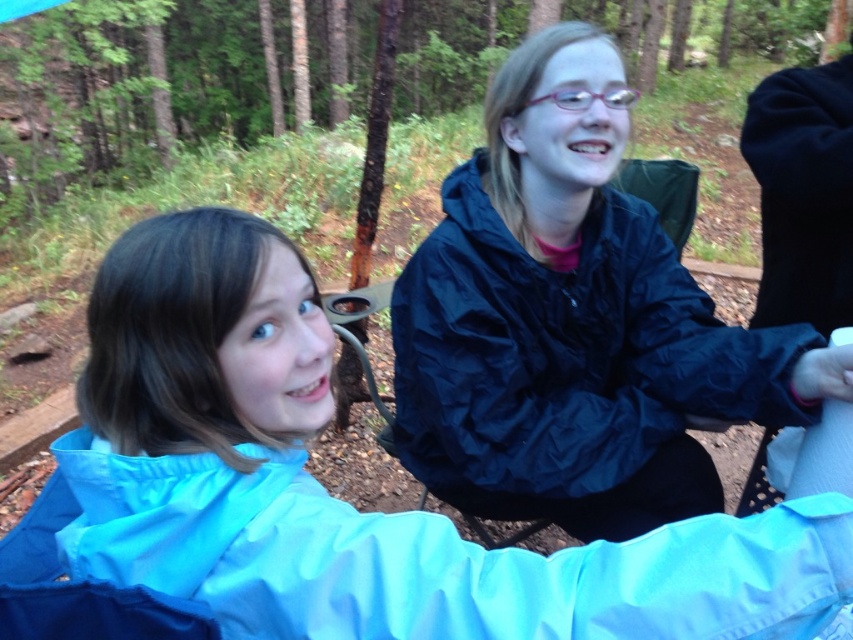
You are planning to take a hike and want to know which jacket is more suitable for carrying in a backpack. Considering their sizes, which one between the blue waterproof jacket at upper left and the matte black jacket at center would be easier to pack?

The blue waterproof jacket at upper left is smaller than the matte black jacket at center, so it would be easier to pack in a backpack.

You are planning to take a photo of the blue waterproof jacket at upper left for a nature photography competition. According to the image coordinates, where exactly should you aim your camera to capture it?

You should aim your camera at point coordinates of (x=328, y=493) to capture the blue waterproof jacket at upper left.

You are standing at the origin point in the forest scene. A blue waterproof jacket is marked at coordinate point (x=328, y=493). If you want to reach the blue waterproof jacket at upper left, which direction should you move from your current position?

The point (x=328, y=493) marks the location of the blue waterproof jacket at upper left. Since the coordinate system is not specified, but assuming standard image coordinates where the origin is at the bottom left corner, moving towards the upper left would mean moving upwards and to the left from your current position at the origin.